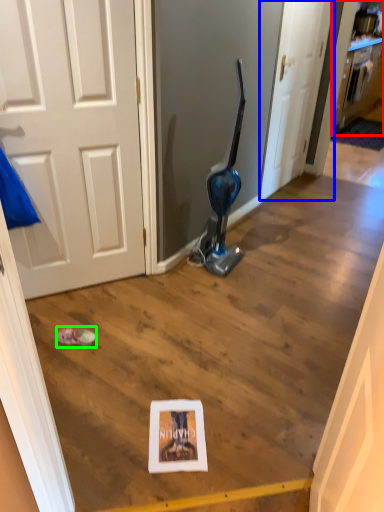
Question: Which is nearer to the cabinetry (highlighted by a red box)? door (highlighted by a blue box) or footwear (highlighted by a green box).

Choices:
 (A) door
 (B) footwear

Answer: (A)